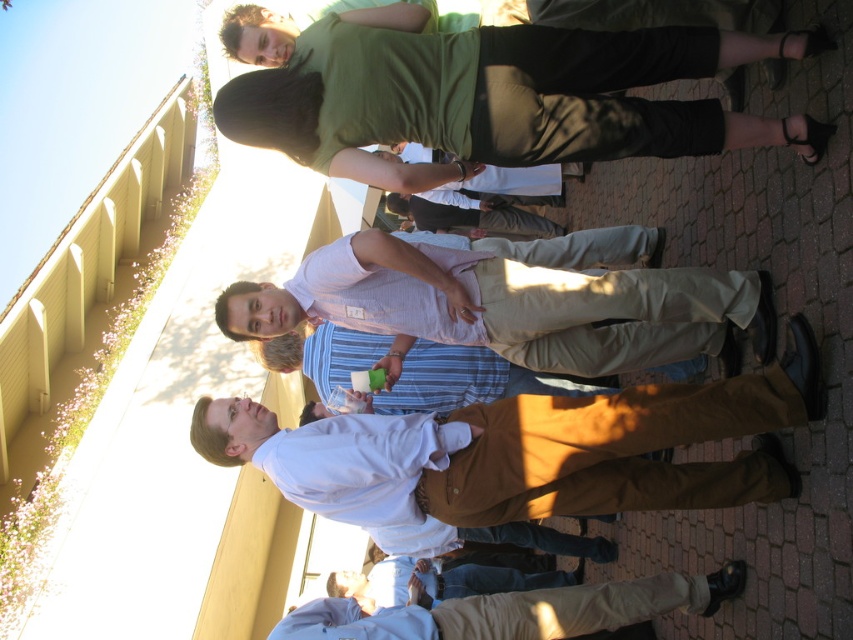
Question: Which of these objects is positioned farthest from the green cotton shirt at upper center?

Choices:
 (A) white cotton shirt at center
 (B) striped cotton shirt at center
 (C) khaki cotton pants at center

Answer: (C)

Question: Does light brown cotton pants at center appear on the left side of light brown leather pants at lower center?

Choices:
 (A) yes
 (B) no

Answer: (B)

Question: Which point appears farthest from the camera in this image?

Choices:
 (A) (612, 582)
 (B) (506, 221)

Answer: (B)

Question: Does light brown leather pants at lower center lie in front of khaki cotton pants at center?

Choices:
 (A) no
 (B) yes

Answer: (B)

Question: Does green cotton shirt at upper center come behind light brown leather pants at lower center?

Choices:
 (A) no
 (B) yes

Answer: (A)

Question: Which point appears farthest from the camera in this image?

Choices:
 (A) (639, 108)
 (B) (509, 388)
 (C) (554, 234)
 (D) (582, 456)

Answer: (C)